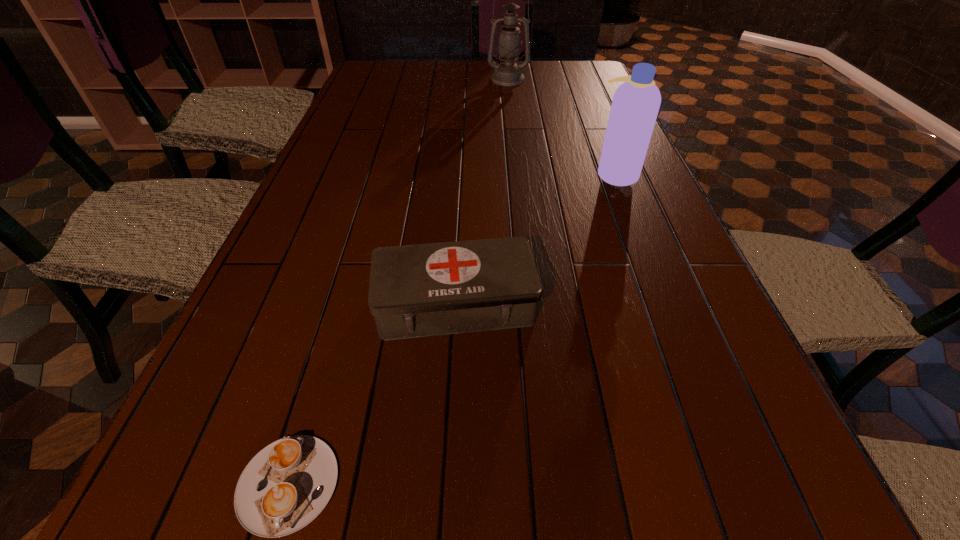
The image size is (960, 540). Identify the location of vacant space positioned 0.110m on the right of the second shortest object. (593, 303).

I want to click on vacant space located on the right of the nearest object, so click(x=387, y=483).

Where is `object at the far edge`? object at the far edge is located at coordinates [x=508, y=73].

You are a GUI agent. You are given a task and a screenshot of the screen. Output one action in this format:
    pyautogui.click(x=<x>, y=<y>)
    Task: Click on the object located in the left edge section of the desktop
    This screenshot has height=540, width=960.
    Given the screenshot: What is the action you would take?
    pyautogui.click(x=285, y=486)

This screenshot has height=540, width=960. Find the location of `object that is positioned at the right edge`. object that is positioned at the right edge is located at coordinates (635, 105).

This screenshot has height=540, width=960. Find the location of `free region at the far edge`. free region at the far edge is located at coordinates (469, 64).

What are the coordinates of `vacant region at the left edge of the desktop` in the screenshot? It's located at (338, 189).

In the image, there is a desktop. Where is `free space at the right edge`? free space at the right edge is located at coordinates (688, 469).

Where is `vacant space at the far left corner of the desktop`? vacant space at the far left corner of the desktop is located at coordinates (363, 78).

Find the location of a particular element. free space between the second shortest object and the nearest object is located at coordinates (372, 394).